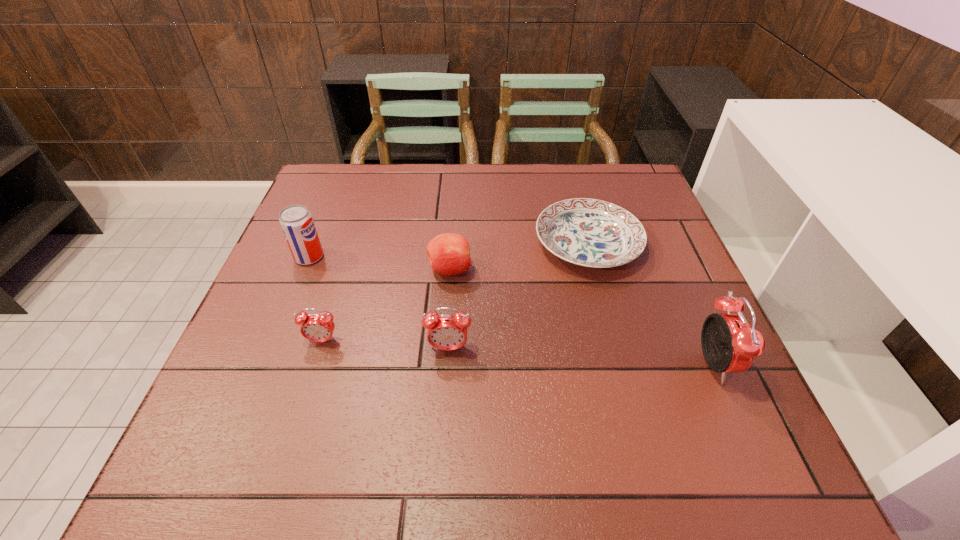
In the image, there is a desktop. Identify the location of vacant space at the near edge. (475, 389).

This screenshot has height=540, width=960. In the image, there is a desktop. In order to click on blank space at the far left corner in this screenshot , I will do `click(358, 167)`.

In the image, there is a desktop. In order to click on blank space at the far right corner in this screenshot , I will do `click(606, 186)`.

Locate an element on the screen. This screenshot has width=960, height=540. vacant space at the near right corner of the desktop is located at coordinates (717, 392).

Locate an element on the screen. Image resolution: width=960 pixels, height=540 pixels. vacant area between the rightmost alarm clock and the soda is located at coordinates (511, 310).

The image size is (960, 540). What are the coordinates of `vacant region between the second object from left to right and the plate` in the screenshot? It's located at (455, 292).

Find the location of a particular element. This screenshot has width=960, height=540. free space that is in between the second object from left to right and the tallest alarm clock is located at coordinates (517, 353).

Find the location of a particular element. Image resolution: width=960 pixels, height=540 pixels. free space between the leftmost object and the tallest alarm clock is located at coordinates (511, 310).

In order to click on vacant region between the leftmost object and the second object from left to right in this screenshot , I will do `click(316, 299)`.

Locate an element on the screen. The height and width of the screenshot is (540, 960). unoccupied area between the rightmost object and the apple is located at coordinates (582, 317).